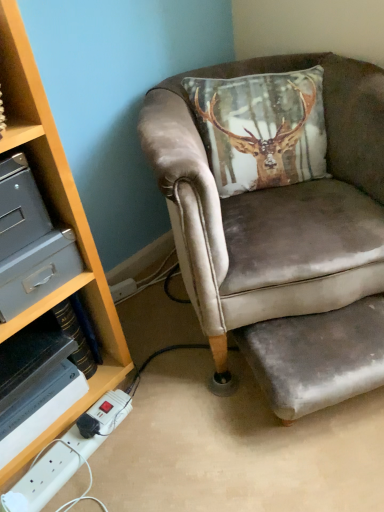
Locate an element on the screen. Image resolution: width=384 pixels, height=512 pixels. vacant space to the left of velvet grey footrest at lower right is located at coordinates (209, 408).